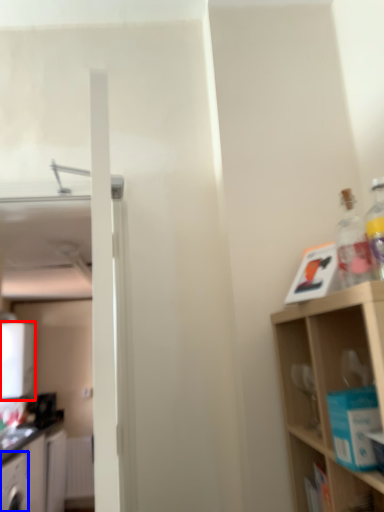
Question: Which of the following is the farthest to the observer, appliance (highlighted by a red box) or cabinetry (highlighted by a blue box)?

Choices:
 (A) appliance
 (B) cabinetry

Answer: (A)